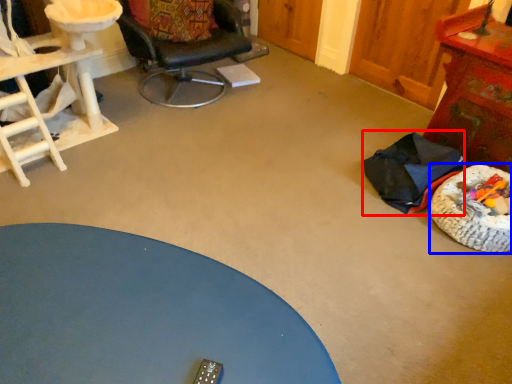
Question: Which object appears closest to the camera in this image, chair (highlighted by a red box) or dog bed (highlighted by a blue box)?

Choices:
 (A) chair
 (B) dog bed

Answer: (B)